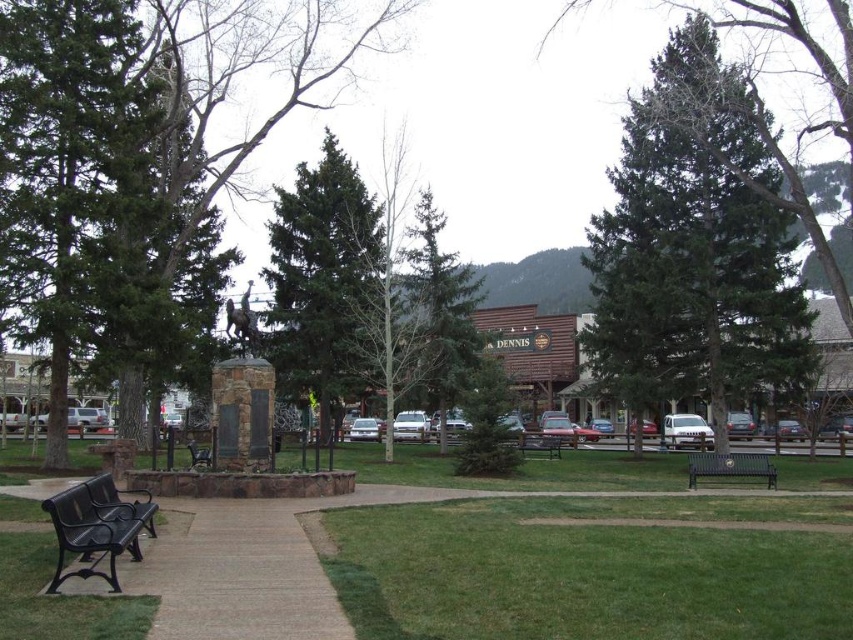
You are a GUI agent. You are given a task and a screenshot of the screen. Output one action in this format:
    pyautogui.click(x=<x>, y=<y>)
    Task: Click on the green needle-like tree at center
    This screenshot has width=853, height=640.
    Given the screenshot: What is the action you would take?
    pyautogui.click(x=699, y=237)

Is point (735, 337) closer to viewer compared to point (560, 440)?

Yes, point (735, 337) is closer to viewer.

Find the location of `green needle-like tree at center`. green needle-like tree at center is located at coordinates (699, 237).

Is green fir tree at center to the left of black metal bench at lower left from the viewer's perspective?

Indeed, green fir tree at center is positioned on the left side of black metal bench at lower left.

Which is behind, point (350, 372) or point (86, 490)?

Point (350, 372)

This screenshot has height=640, width=853. I want to click on green fir tree at center, so click(x=321, y=276).

What do you see at coordinates (140, 163) in the screenshot? The image size is (853, 640). I see `green textured tree at center` at bounding box center [140, 163].

Can you confirm if green textured tree at center is positioned to the right of metallic green bench at lower right?

No, green textured tree at center is not to the right of metallic green bench at lower right.

Which is in front, point (276, 20) or point (744, 467)?

Positioned in front is point (744, 467).

The height and width of the screenshot is (640, 853). I want to click on green textured tree at center, so click(140, 163).